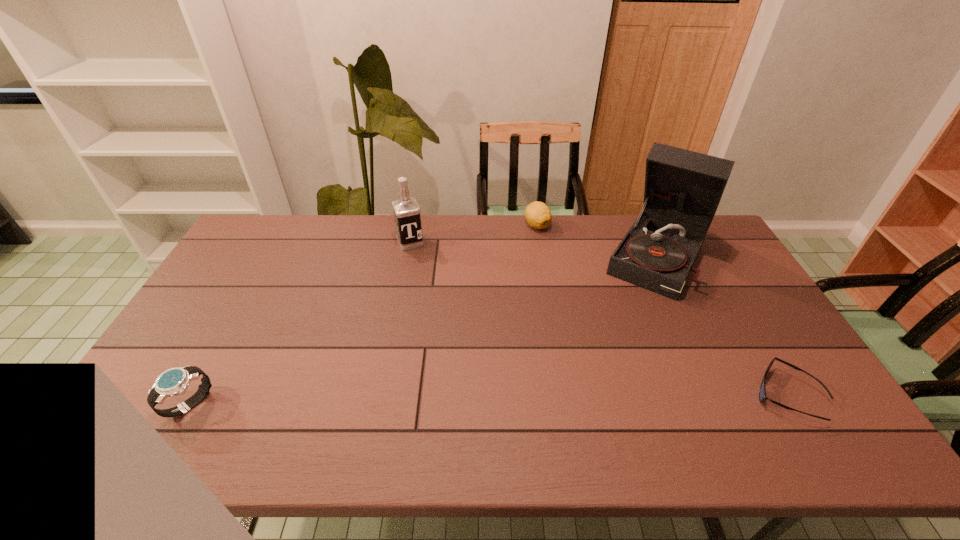
Locate an element on the screen. This screenshot has width=960, height=540. object that is at the far right corner is located at coordinates (683, 188).

What are the coordinates of `object located in the near right corner section of the desktop` in the screenshot? It's located at (762, 393).

In the image, there is a desktop. At what (x,y) coordinates should I click in order to perform the action: click on vacant space at the far edge. Please return your answer as a coordinate pair (x, y). Looking at the image, I should click on (446, 242).

The image size is (960, 540). I want to click on vacant space at the near edge of the desktop, so click(x=575, y=403).

You are a GUI agent. You are given a task and a screenshot of the screen. Output one action in this format:
    pyautogui.click(x=<x>, y=<y>)
    Task: Click on the vacant region at the right edge of the desktop
    The height and width of the screenshot is (540, 960).
    Given the screenshot: What is the action you would take?
    pyautogui.click(x=693, y=273)

Find the location of a particular element. Image resolution: width=960 pixels, height=540 pixels. free space between the second object from left to right and the shortest object is located at coordinates (599, 319).

Image resolution: width=960 pixels, height=540 pixels. I want to click on free space between the tallest object and the leftmost object, so click(424, 330).

Where is `vacant space that's between the shortest object and the second object from left to right`? This screenshot has width=960, height=540. vacant space that's between the shortest object and the second object from left to right is located at coordinates [x=599, y=319].

Identify the location of unoccupied area between the sunglasses and the tallest object. (722, 325).

Where is `vacant area that lies between the third object from left to right and the tallest object`? vacant area that lies between the third object from left to right and the tallest object is located at coordinates (597, 240).